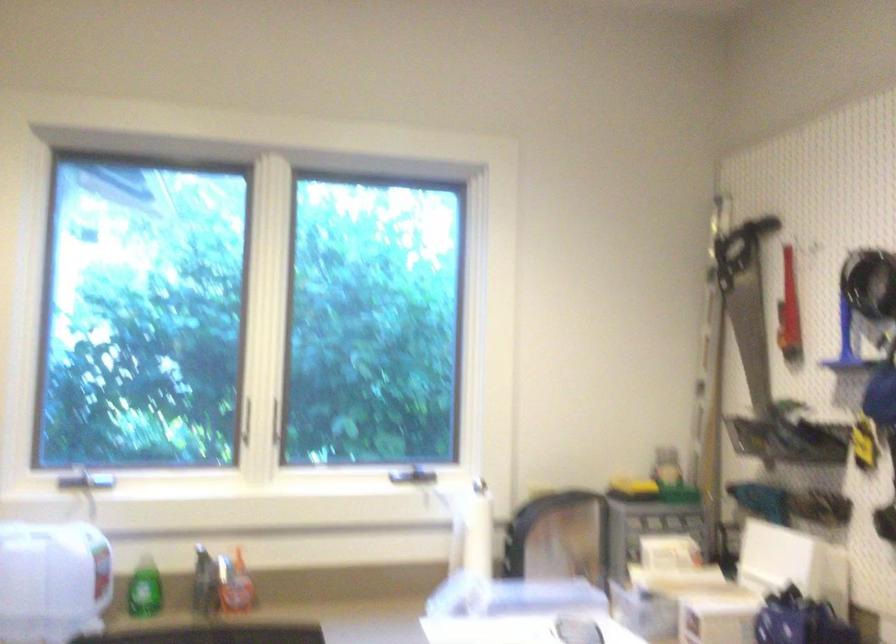
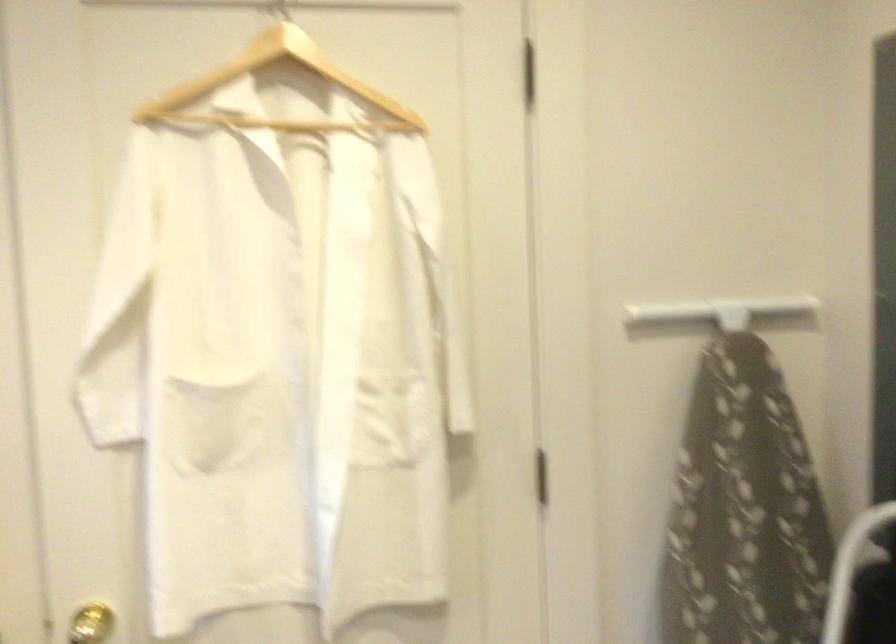
Question: The camera is either moving clockwise (left) or counter-clockwise (right) around the object. The first image is from the beginning of the video and the second image is from the end. Is the camera moving left or right when shooting the video?

Choices:
 (A) Left
 (B) Right

Answer: (A)